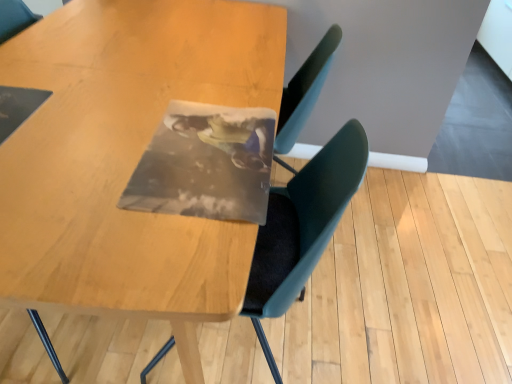
Identify the location of free point above wooden table at center (from a real-world perspective). Image resolution: width=512 pixels, height=384 pixels. (145, 72).